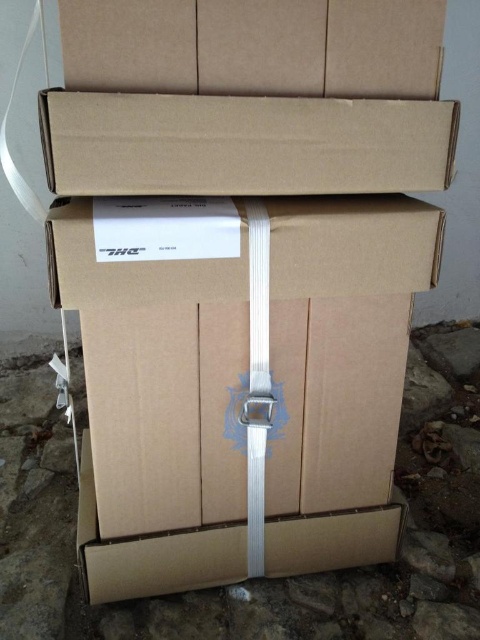
You are organizing boxes in a storage area. You need to place a new box between the brown cardboard box at center and the brown cardboard box at upper center. Based on their positions, where should you place the new box?

The brown cardboard box at center is to the left of brown cardboard box at upper center, so you should place the new box between them to the right of the brown cardboard box at center and to the left of the brown cardboard box at upper center.

You are standing at the origin point of the coordinate system. You need to move towards the brown cardboard box at center. Which direction should you move in?

The brown cardboard box at center is located at point [250,390], so you should move towards the positive x and y directions to reach it.